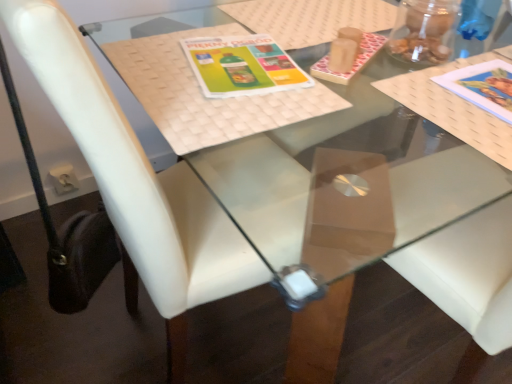
Question: Considering the relative sizes of matte green plastic book cover at center, placed as the 2th book cover when sorted from right to left, and matte paper book at upper right, which appears as the 2th book cover when viewed from the left, in the image provided, is matte green plastic book cover at center, placed as the 2th book cover when sorted from right to left, bigger than matte paper book at upper right, which appears as the 2th book cover when viewed from the left,?

Choices:
 (A) yes
 (B) no

Answer: (B)

Question: Considering the relative sizes of matte green plastic book cover at center, placed as the 2th book cover when sorted from right to left, and matte paper book at upper right, which appears as the 2th book cover when viewed from the left, in the image provided, is matte green plastic book cover at center, placed as the 2th book cover when sorted from right to left, wider than matte paper book at upper right, which appears as the 2th book cover when viewed from the left,?

Choices:
 (A) no
 (B) yes

Answer: (A)

Question: Is matte green plastic book cover at center, the first book cover viewed from the left, not close to matte paper book at upper right, which appears as the 2th book cover when viewed from the left?

Choices:
 (A) no
 (B) yes

Answer: (A)

Question: From the image's perspective, is matte green plastic book cover at center, the first book cover viewed from the left, over matte paper book at upper right, which appears as the 2th book cover when viewed from the left?

Choices:
 (A) yes
 (B) no

Answer: (A)

Question: From a real-world perspective, is matte green plastic book cover at center, placed as the 2th book cover when sorted from right to left, beneath matte paper book at upper right, which appears as the 2th book cover when viewed from the left?

Choices:
 (A) yes
 (B) no

Answer: (A)

Question: Is matte green plastic book cover at center, the first book cover viewed from the left, outside matte paper book at upper right, which ranks as the 1th book cover in right-to-left order?

Choices:
 (A) yes
 (B) no

Answer: (A)

Question: From the image's perspective, is matte paper book at upper right, which appears as the 2th book cover when viewed from the left, under white leather chair at center?

Choices:
 (A) yes
 (B) no

Answer: (B)

Question: From the image's perspective, is matte paper book at upper right, which ranks as the 1th book cover in right-to-left order, over white leather chair at center?

Choices:
 (A) yes
 (B) no

Answer: (A)

Question: From a real-world perspective, is matte paper book at upper right, which appears as the 2th book cover when viewed from the left, physically below white leather chair at center?

Choices:
 (A) no
 (B) yes

Answer: (A)

Question: Is matte paper book at upper right, which ranks as the 1th book cover in right-to-left order, in front of white leather chair at center?

Choices:
 (A) no
 (B) yes

Answer: (A)

Question: Is matte paper book at upper right, which ranks as the 1th book cover in right-to-left order, with white leather chair at center?

Choices:
 (A) no
 (B) yes

Answer: (A)

Question: Considering the relative sizes of matte paper book at upper right, which ranks as the 1th book cover in right-to-left order, and white leather chair at center in the image provided, is matte paper book at upper right, which ranks as the 1th book cover in right-to-left order, thinner than white leather chair at center?

Choices:
 (A) no
 (B) yes

Answer: (B)

Question: Is white leather chair at center wider than matte paper book at upper right, which ranks as the 1th book cover in right-to-left order?

Choices:
 (A) yes
 (B) no

Answer: (A)